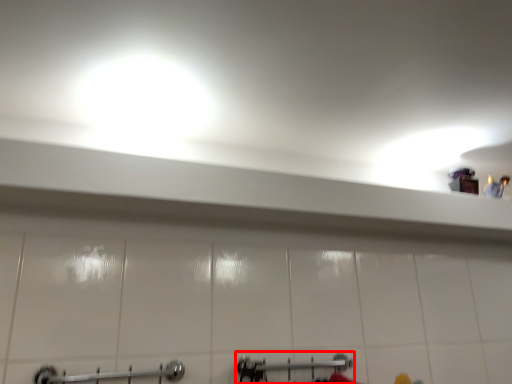
Question: From the image's perspective, considering the relative positions of shower (annotated by the red box) and towel rack in the image provided, where is shower (annotated by the red box) located with respect to the staircase?

Choices:
 (A) below
 (B) above

Answer: (A)